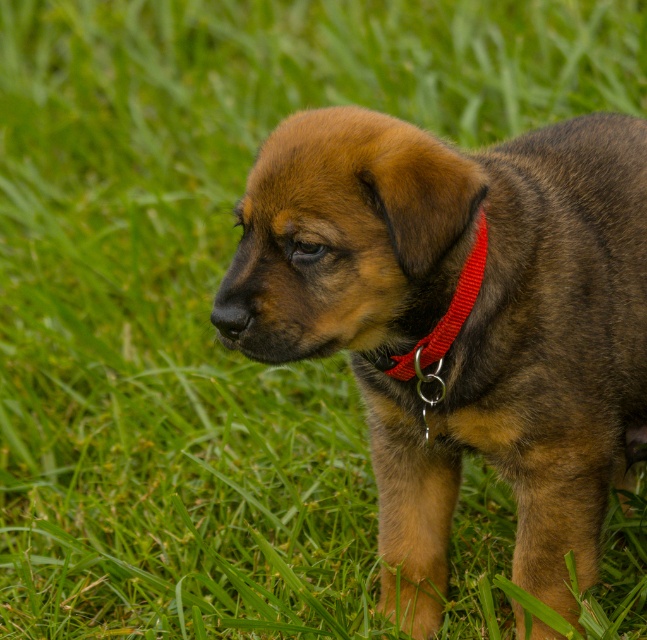
Question: Which of the following is the farthest from the observer?

Choices:
 (A) (448, 332)
 (B) (606, 118)

Answer: (B)

Question: Does brown fur dog at center have a smaller size compared to red nylon collar at center?

Choices:
 (A) yes
 (B) no

Answer: (B)

Question: Considering the relative positions of brown fur dog at center and red nylon collar at center in the image provided, where is brown fur dog at center located with respect to red nylon collar at center?

Choices:
 (A) above
 (B) below

Answer: (B)

Question: Does brown fur dog at center appear under red nylon collar at center?

Choices:
 (A) no
 (B) yes

Answer: (B)